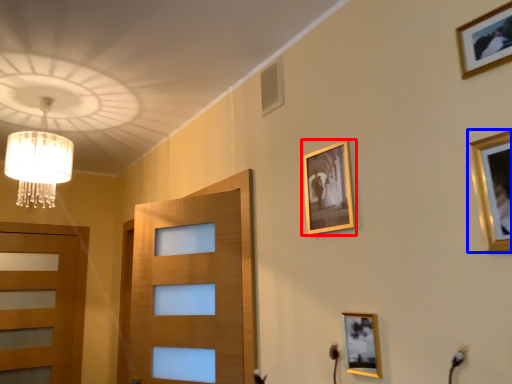
Question: Which point is closer to the camera, picture frame (highlighted by a red box) or picture frame (highlighted by a blue box)?

Choices:
 (A) picture frame
 (B) picture frame

Answer: (B)